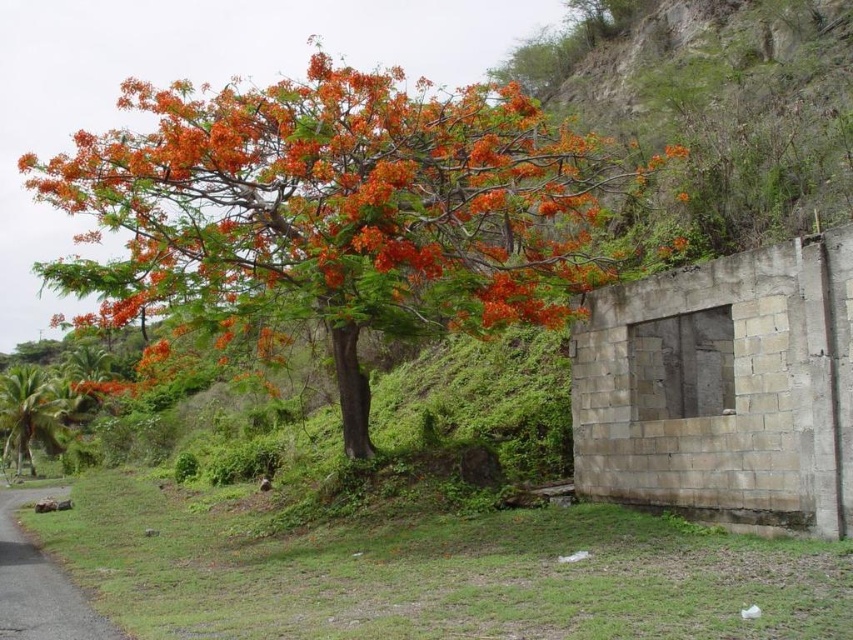
You are standing in the middle of the scene and want to walk towards the green leafy palm at lower left. Which direction should you turn to face the orange leafy tree at center?

Since the orange leafy tree at center is to the right of the green leafy palm at lower left, you should turn to your right to face the orange leafy tree at center.

You are a landscape architect planning to plant a new tree in this area. Given the sizes of the orange leafy tree at center and the green leafy palm at lower left, which one would require more space for its root system?

The orange leafy tree at center requires more space for its root system because it is bigger than the green leafy palm at lower left.

You are standing in the natural scene and want to take a photo of both the orange leafy tree at center and the green leafy palm at lower left. Which tree should you focus on first to ensure both are in clear view?

You should focus on the orange leafy tree at center first because it is closer to the viewer than the green leafy palm at lower left, so adjusting focus starting from the closer object will help capture both clearly.